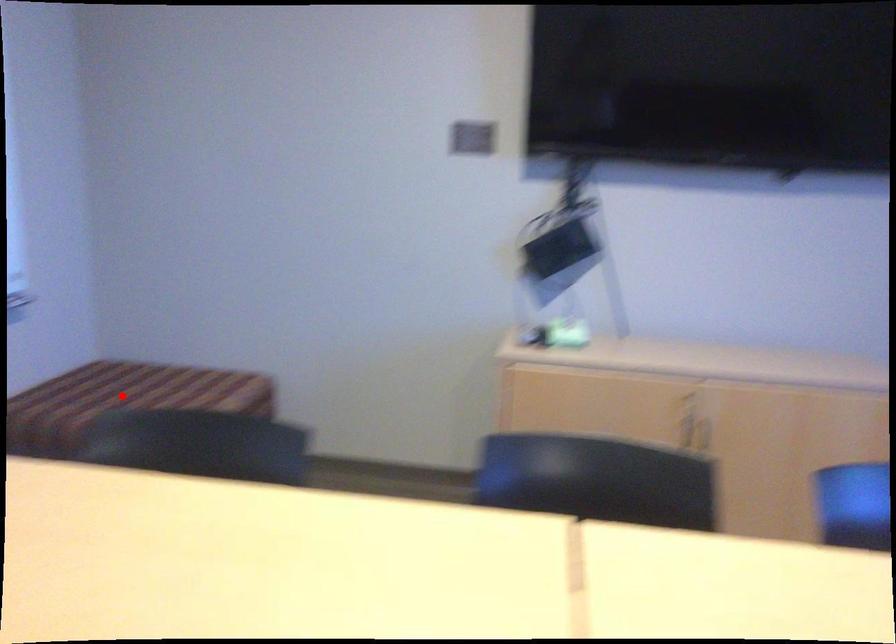
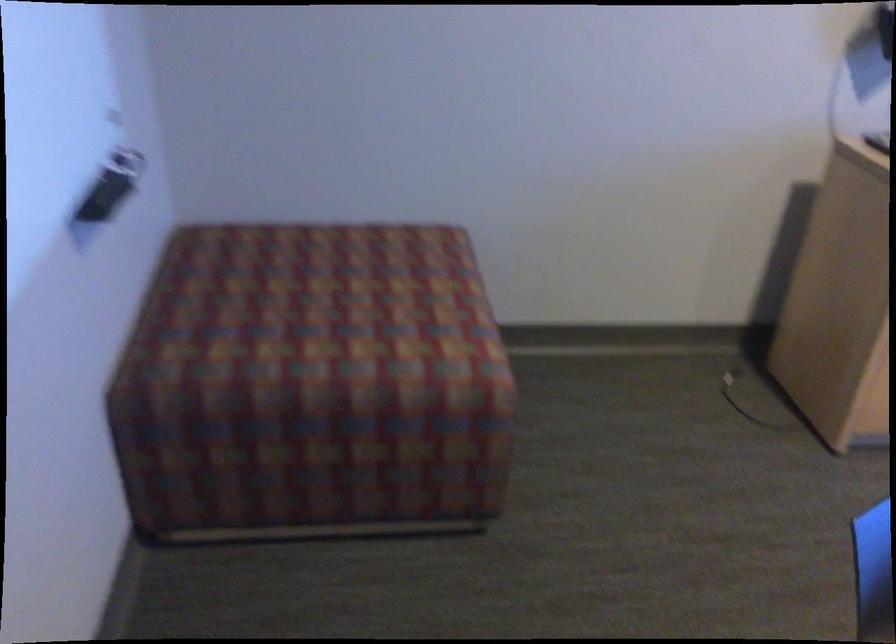
In the second image, find the point that corresponds to the highlighted location in the first image.

(332, 301)